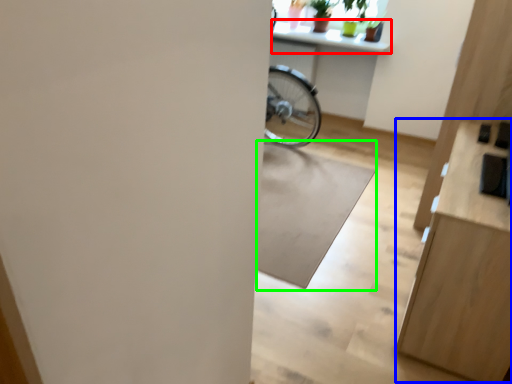
Question: Which object is the closest to the counter top (highlighted by a red box)? Choose among these: dresser (highlighted by a blue box) or mat (highlighted by a green box).

Choices:
 (A) dresser
 (B) mat

Answer: (B)